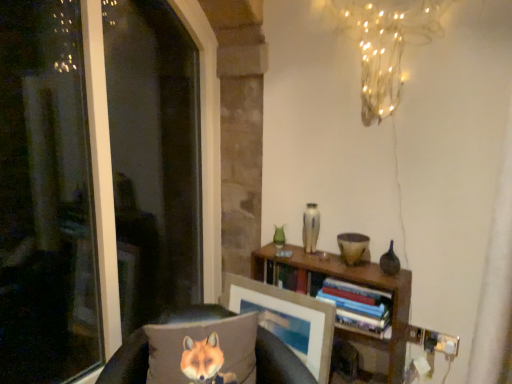
Question: From a real-world perspective, is transparent glass window at left above or below illuminated wire at upper center?

Choices:
 (A) above
 (B) below

Answer: (B)

Question: Is transparent glass window at left bigger or smaller than illuminated wire at upper center?

Choices:
 (A) big
 (B) small

Answer: (A)

Question: Which of these objects is positioned closest to the matte wooden picture frame at center?

Choices:
 (A) wooden bookshelf at center
 (B) hardcover books at center
 (C) brown fabric pillow at lower left
 (D) illuminated wire at upper center
 (E) textured gray pillow with fox print at lower left

Answer: (A)

Question: Which object is positioned closest to the textured gray pillow with fox print at lower left?

Choices:
 (A) matte wooden picture frame at center
 (B) transparent glass window at left
 (C) wooden bookshelf at center
 (D) brown fabric pillow at lower left
 (E) hardcover books at center

Answer: (D)